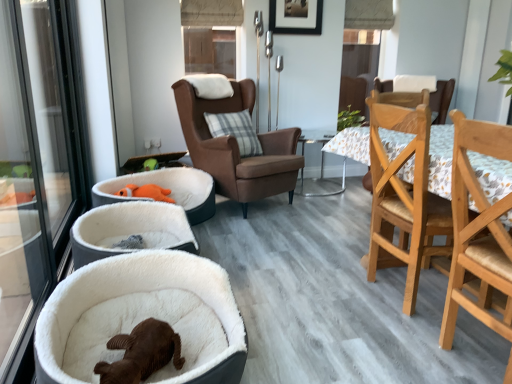
Question: In terms of size, does brown leather armchair at center, marked as the first chair in a back-to-front arrangement, appear bigger or smaller than plaid fabric pillow at center?

Choices:
 (A) small
 (B) big

Answer: (B)

Question: Visually, is brown leather armchair at center, marked as the first chair in a back-to-front arrangement, positioned to the left or to the right of plaid fabric pillow at center?

Choices:
 (A) left
 (B) right

Answer: (B)

Question: Which object is the farthest from the floral fabric table at center?

Choices:
 (A) light wood/wooden dining chair at right, the third chair viewed from the back
 (B) plaid fabric pillow at center
 (C) wooden picture frame at upper center
 (D) light brown wood chair at right, positioned as the 2th chair in back-to-front order
 (E) brown leather armchair at center, marked as the first chair in a back-to-front arrangement

Answer: (A)

Question: Which of these objects is positioned closest to the floral fabric table at center?

Choices:
 (A) brown leather armchair at center, the 3th chair in the front-to-back sequence
 (B) transparent glass window at upper center
 (C) white plush dog bed at lower left
 (D) plaid fabric pillow at center
 (E) light brown wood chair at right, positioned as the 2th chair in back-to-front order

Answer: (A)